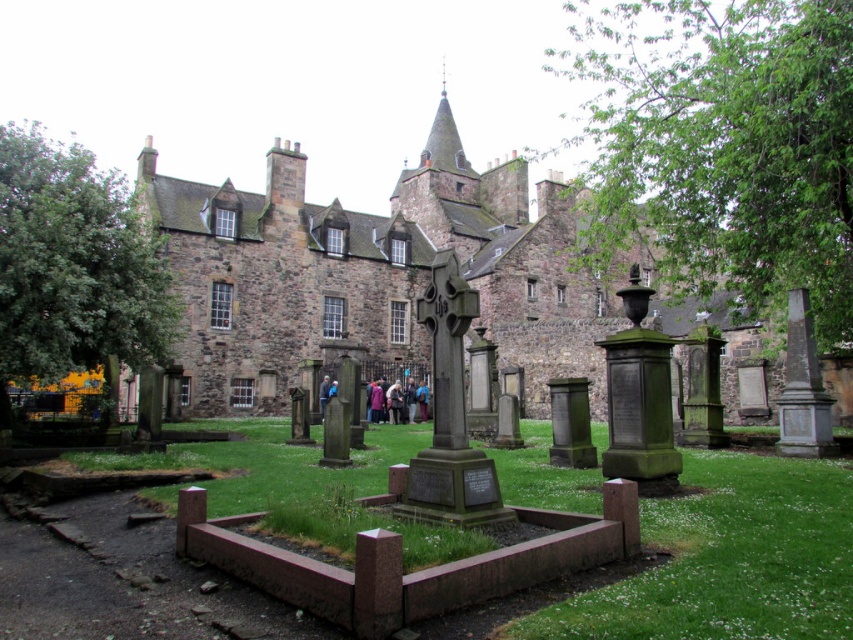
Between point (540, 289) and point (392, 404), which one is positioned in front?

Point (392, 404) is in front.

Can you confirm if brown stone castle at center is smaller than dark purple sweater at center?

Actually, brown stone castle at center might be larger than dark purple sweater at center.

Does point (158, 182) come behind point (392, 408)?

Yes, point (158, 182) is behind point (392, 408).

At what (x,y) coordinates should I click in order to perform the action: click on brown stone castle at center. Please return your answer as a coordinate pair (x, y). This screenshot has width=853, height=640. Looking at the image, I should click on (373, 273).

This screenshot has width=853, height=640. What do you see at coordinates (393, 401) in the screenshot?
I see `dark purple sweater at center` at bounding box center [393, 401].

Is dark purple sweater at center thinner than dark blue fabric at center?

Indeed, dark purple sweater at center has a lesser width compared to dark blue fabric at center.

The image size is (853, 640). What do you see at coordinates (393, 401) in the screenshot?
I see `dark purple sweater at center` at bounding box center [393, 401].

This screenshot has height=640, width=853. Identify the location of dark purple sweater at center. (393, 401).

Who is positioned more to the right, brown stone castle at center or dark blue fabric at center?

brown stone castle at center is more to the right.

Can you confirm if brown stone castle at center is shorter than dark blue fabric at center?

No.

Is point (515, 234) less distant than point (329, 387)?

No, (515, 234) is behind (329, 387).

You are a GUI agent. You are given a task and a screenshot of the screen. Output one action in this format:
    pyautogui.click(x=<x>, y=<y>)
    Task: Click on the brown stone castle at center
    This screenshot has width=853, height=640.
    Given the screenshot: What is the action you would take?
    pyautogui.click(x=373, y=273)